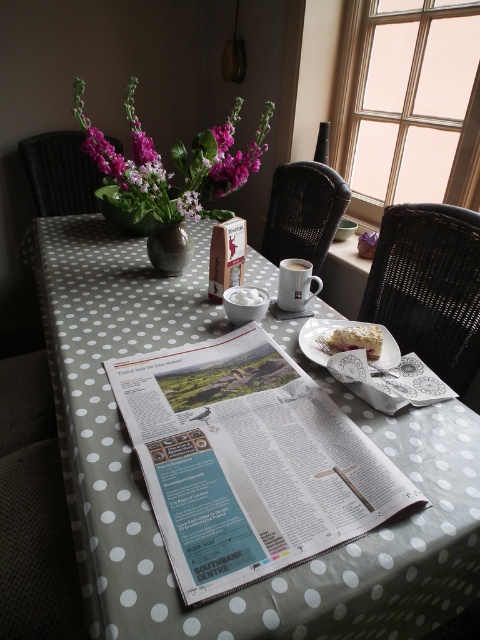
Question: Which point is closer to the camera taking this photo?

Choices:
 (A) (193, 218)
 (B) (283, 317)
 (C) (445, 481)
 (D) (342, 336)

Answer: (C)

Question: Can you confirm if purple matte flower at center is positioned to the right of white ceramic saucer at center?

Choices:
 (A) yes
 (B) no

Answer: (B)

Question: Does crumbly white cake at lower right lie behind white ceramic saucer at center?

Choices:
 (A) no
 (B) yes

Answer: (A)

Question: Which object is the closest to the matte gray vase at center?

Choices:
 (A) white fluffy sugar at center
 (B) black woven chair at right
 (C) white ceramic plate at center
 (D) white matte mug at center

Answer: (A)

Question: Is white printed newspaper at center smaller than wicker chair at left?

Choices:
 (A) yes
 (B) no

Answer: (B)

Question: Among these objects, which one is farthest from the camera?

Choices:
 (A) matte gray vase at center
 (B) purple matte flower at center
 (C) white ceramic plate at center
 (D) black woven chair at right

Answer: (A)